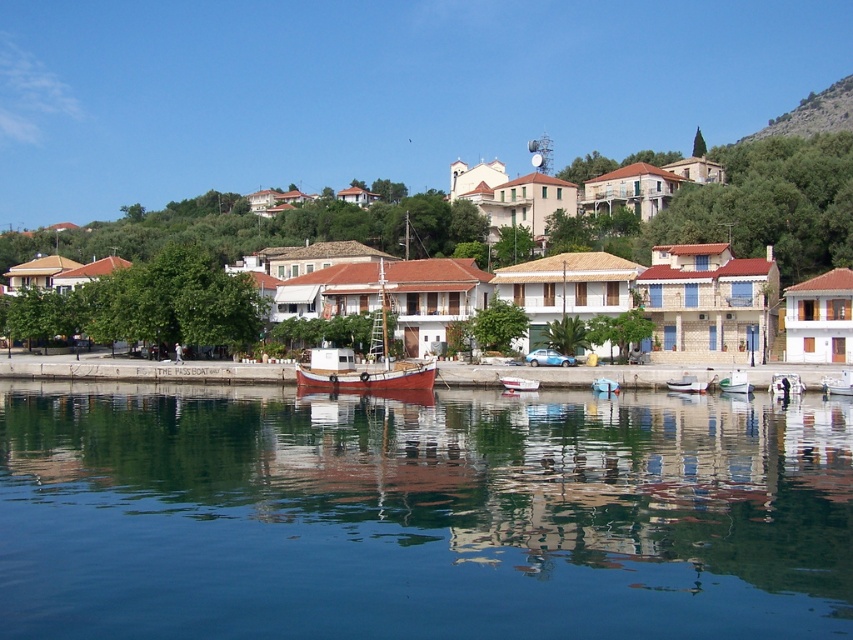
Does red wooden boat at center have a smaller size compared to green grassy hillside at upper right?

Correct, red wooden boat at center occupies less space than green grassy hillside at upper right.

Is red wooden boat at center bigger than green grassy hillside at upper right?

No.

Is point (364, 384) less distant than point (813, 96)?

That is True.

The image size is (853, 640). Find the location of `red wooden boat at center`. red wooden boat at center is located at coordinates (366, 371).

Does transparent water at center appear under green grassy hillside at upper right?

Yes, transparent water at center is below green grassy hillside at upper right.

Describe the element at coordinates (421, 515) in the screenshot. This screenshot has width=853, height=640. I see `transparent water at center` at that location.

Between point (607, 422) and point (816, 93), which one is positioned behind?

The point (816, 93) is behind.

Identify the location of transparent water at center. This screenshot has height=640, width=853. (421, 515).

Locate an element on the screen. white plastic boat at center is located at coordinates (735, 381).

Locate an element on the screen. white plastic boat at center is located at coordinates (735, 381).